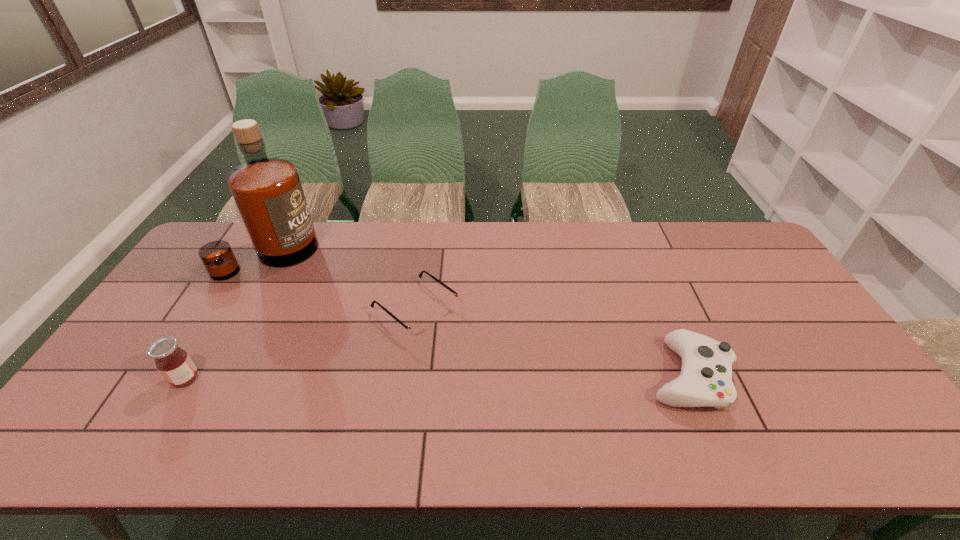
This screenshot has width=960, height=540. Find the location of `free space between the jam and the second shortest object`. free space between the jam and the second shortest object is located at coordinates (437, 377).

The width and height of the screenshot is (960, 540). What are the coordinates of `empty location between the liquor and the shortest object` in the screenshot? It's located at (343, 282).

Identify the location of empty location between the third tallest object and the liquor. (479, 315).

This screenshot has width=960, height=540. I want to click on free spot between the second tallest object and the control, so click(437, 377).

Locate an element on the screen. The image size is (960, 540). vacant area that lies between the tallest object and the third object from left to right is located at coordinates (343, 282).

This screenshot has width=960, height=540. Identify the location of object that stands as the third closest to the jam. (705, 380).

Where is `object that is the second nearest to the liquor`? This screenshot has height=540, width=960. object that is the second nearest to the liquor is located at coordinates (175, 365).

Image resolution: width=960 pixels, height=540 pixels. I want to click on free location that satisfies the following two spatial constraints: 1. on the front side of the liquor; 2. on the left side of the shortest object, so [239, 309].